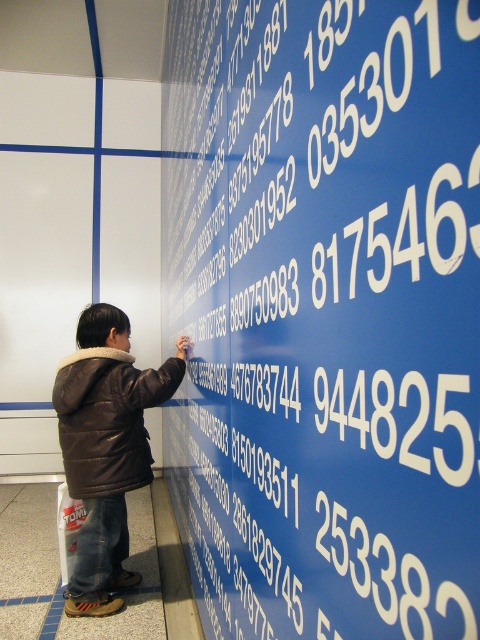
Does blue matte wall at center have a larger size compared to black leather jacket at left?

Indeed, blue matte wall at center has a larger size compared to black leather jacket at left.

Does point (208, 241) come in front of point (88, 380)?

That is True.

Is point (173, 500) behind point (80, 481)?

Yes, point (173, 500) is behind point (80, 481).

What are the coordinates of `blue matte wall at center` in the screenshot? It's located at (324, 314).

Between brown leather jacket at center and black leather jacket at left, which one has more height?

brown leather jacket at center

Is point (74, 368) positioned in front of point (81, 435)?

That is False.

The height and width of the screenshot is (640, 480). What do you see at coordinates (107, 448) in the screenshot?
I see `brown leather jacket at center` at bounding box center [107, 448].

Locate an element on the screen. Image resolution: width=480 pixels, height=640 pixels. brown leather jacket at center is located at coordinates (107, 448).

From the picture: Which is more to the right, blue matte wall at center or brown leather jacket at center?

Positioned to the right is blue matte wall at center.

Is point (203, 422) positioned after point (119, 540)?

That is False.

Locate an element on the screen. The width and height of the screenshot is (480, 640). blue matte wall at center is located at coordinates click(324, 314).